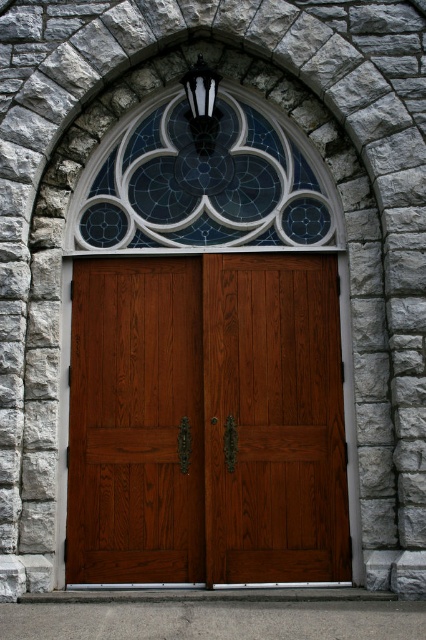
You are an architect designing a new building and want to ensure proper proportions between the doors and the window. Based on the image, which object is taller between the satin wood doors at center and the stained glass window at upper center?

The satin wood doors at center are taller than the stained glass window at upper center according to the description.

You are an architect examining the building facade. You need to determine the spatial relationship between the satin wood doors at center and the stained glass window at upper center. Which object is positioned to the right of the other?

The satin wood doors at center is to the right of stained glass window at upper center.

You are an architect designing a new building entrance. You want to ensure that the entrance has a stained glass window above the doors. Based on the image provided, is the stained glass window at upper center positioned correctly above the satin wood doors at center?

Yes, the stained glass window at upper center is positioned correctly above the satin wood doors at center because the satin wood doors at center is below stained glass window at upper center.